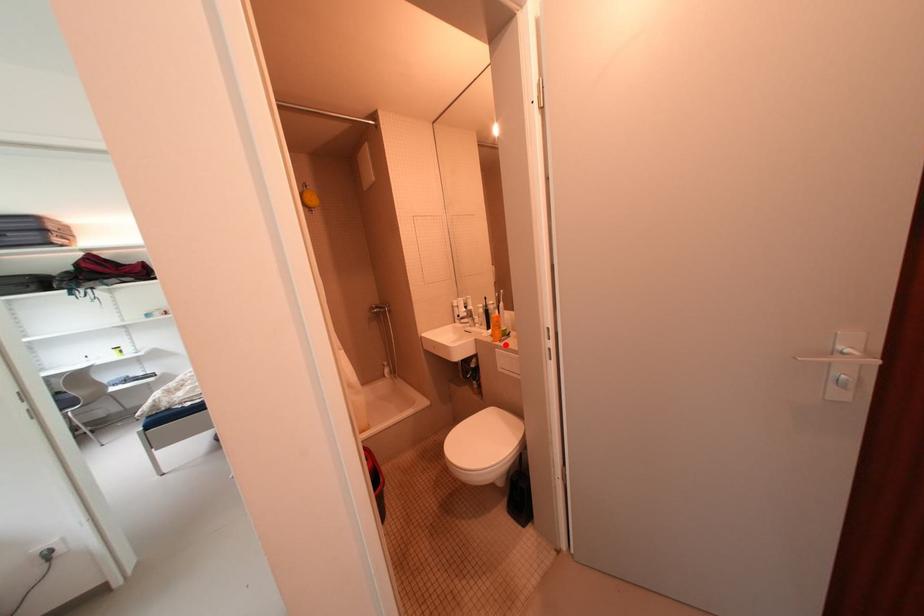
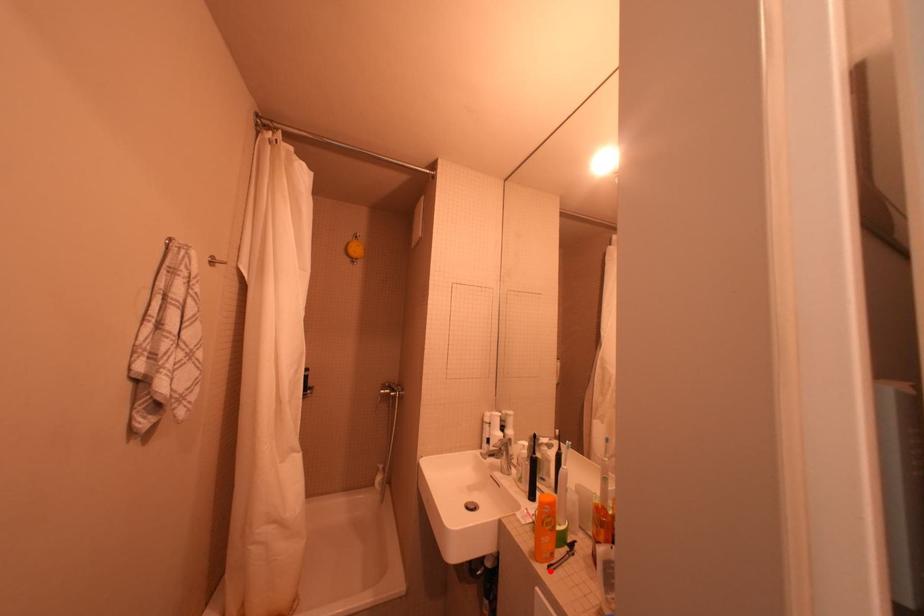
I am providing you with two images of the same scene from different viewpoints. A red point is marked on the first image and another point is marked on the second image. Do the highlighted points in image1 and image2 indicate the same real-world spot?

Yes